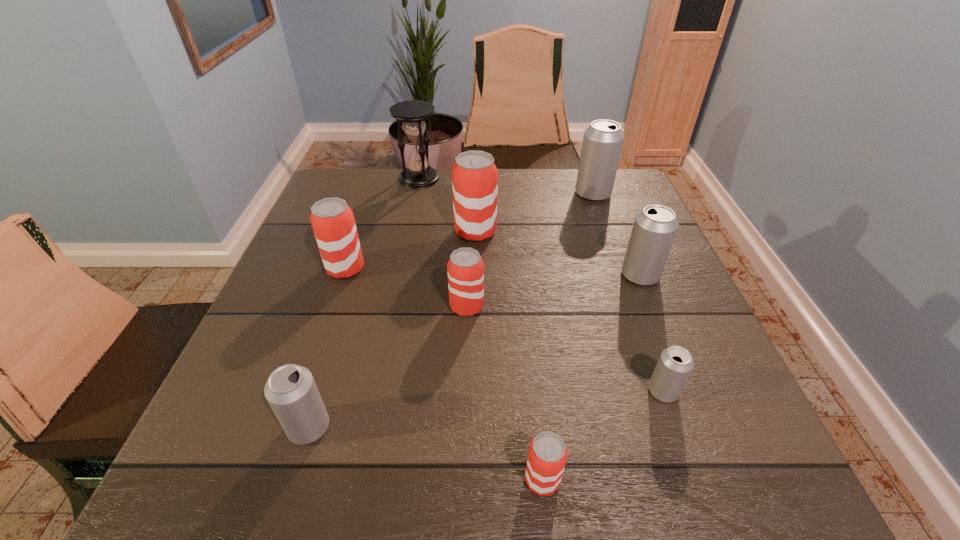
This screenshot has height=540, width=960. I want to click on the fourth closest white beer can to the sixth object from left to right, so click(x=602, y=143).

Select which orange beer can is the closest to the biggest white beer can. Please provide its 2D coordinates. Your answer should be formatted as a tuple, i.e. [(x, y)], where the tuple contains the x and y coordinates of a point satisfying the conditions above.

[(474, 175)]

The width and height of the screenshot is (960, 540). I want to click on orange beer can that is the second closest to the sixth object from left to right, so click(333, 223).

At what (x,y) coordinates should I click in order to perform the action: click on vacant space that satisfies the following two spatial constraints: 1. on the front side of the fourth nearest object; 2. on the left side of the nearest object. Please return your answer as a coordinate pair (x, y). This screenshot has height=540, width=960. Looking at the image, I should click on (461, 480).